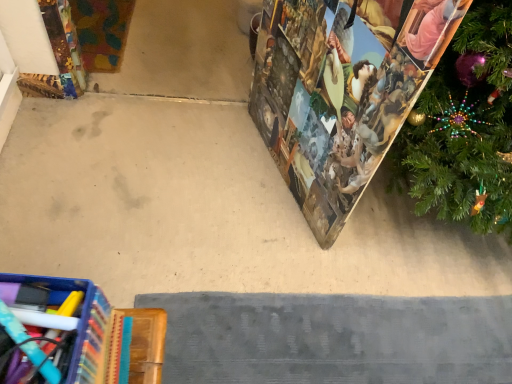
Question: Is beige carpet at center located outside printed paper advent calendar at right?

Choices:
 (A) no
 (B) yes

Answer: (B)

Question: From the image's perspective, is beige carpet at center below printed paper advent calendar at right?

Choices:
 (A) no
 (B) yes

Answer: (B)

Question: From the image's perspective, is beige carpet at center on top of printed paper advent calendar at right?

Choices:
 (A) yes
 (B) no

Answer: (B)

Question: Does beige carpet at center appear on the left side of printed paper advent calendar at right?

Choices:
 (A) yes
 (B) no

Answer: (A)

Question: Is beige carpet at center shorter than printed paper advent calendar at right?

Choices:
 (A) no
 (B) yes

Answer: (B)

Question: Is beige carpet at center with printed paper advent calendar at right?

Choices:
 (A) yes
 (B) no

Answer: (B)

Question: Is printed paper advent calendar at right far away from beige carpet at center?

Choices:
 (A) yes
 (B) no

Answer: (B)

Question: Is printed paper advent calendar at right positioned in front of beige carpet at center?

Choices:
 (A) yes
 (B) no

Answer: (A)

Question: Could you tell me if printed paper advent calendar at right is turned towards beige carpet at center?

Choices:
 (A) no
 (B) yes

Answer: (B)

Question: Is the surface of printed paper advent calendar at right in direct contact with beige carpet at center?

Choices:
 (A) yes
 (B) no

Answer: (B)

Question: Is printed paper advent calendar at right wider than beige carpet at center?

Choices:
 (A) no
 (B) yes

Answer: (A)

Question: Is printed paper advent calendar at right to the right of beige carpet at center from the viewer's perspective?

Choices:
 (A) yes
 (B) no

Answer: (A)

Question: Considering their positions, is beige carpet at center located in front of or behind printed paper advent calendar at right?

Choices:
 (A) behind
 (B) front

Answer: (A)